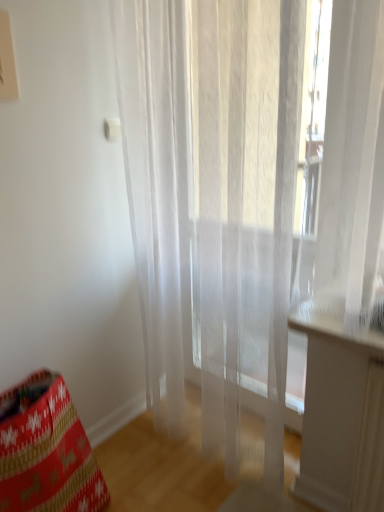
Question: In the image, is red knit bean bag chair at lower left positioned in front of or behind transparent fabric curtain at center?

Choices:
 (A) behind
 (B) front

Answer: (A)

Question: From the image's perspective, is red knit bean bag chair at lower left located above or below transparent fabric curtain at center?

Choices:
 (A) below
 (B) above

Answer: (A)

Question: In the image, is red knit bean bag chair at lower left on the left side or the right side of transparent fabric curtain at center?

Choices:
 (A) left
 (B) right

Answer: (A)

Question: Is transparent fabric curtain at center in front of or behind red knit bean bag chair at lower left in the image?

Choices:
 (A) behind
 (B) front

Answer: (B)

Question: From a real-world perspective, is transparent fabric curtain at center physically located above or below red knit bean bag chair at lower left?

Choices:
 (A) above
 (B) below

Answer: (A)

Question: Looking at the image, does transparent fabric curtain at center seem bigger or smaller compared to red knit bean bag chair at lower left?

Choices:
 (A) big
 (B) small

Answer: (A)

Question: Is transparent fabric curtain at center inside or outside of red knit bean bag chair at lower left?

Choices:
 (A) inside
 (B) outside

Answer: (B)